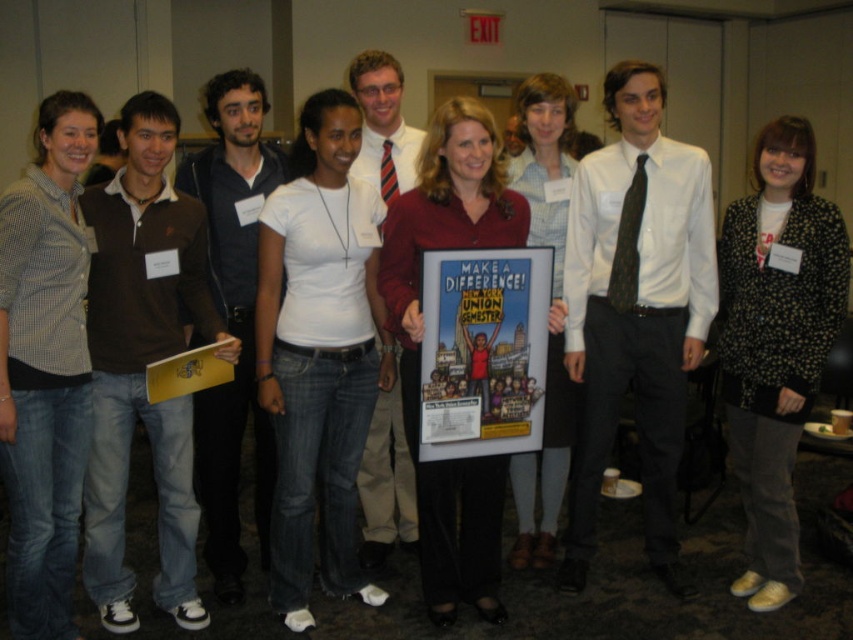
You are a photographer who just took a group photo of the nine individuals. You need to ensure that both the white matte shirt at center and the black dotted blazer at center are clearly visible in the final image. Based on their positions, which one might require more focus adjustment to ensure clarity?

The white matte shirt at center is closer to the viewer than the black dotted blazer at center, so the photographer should focus more on the black dotted blazer at center to ensure clarity since it is further away and might be out of focus.